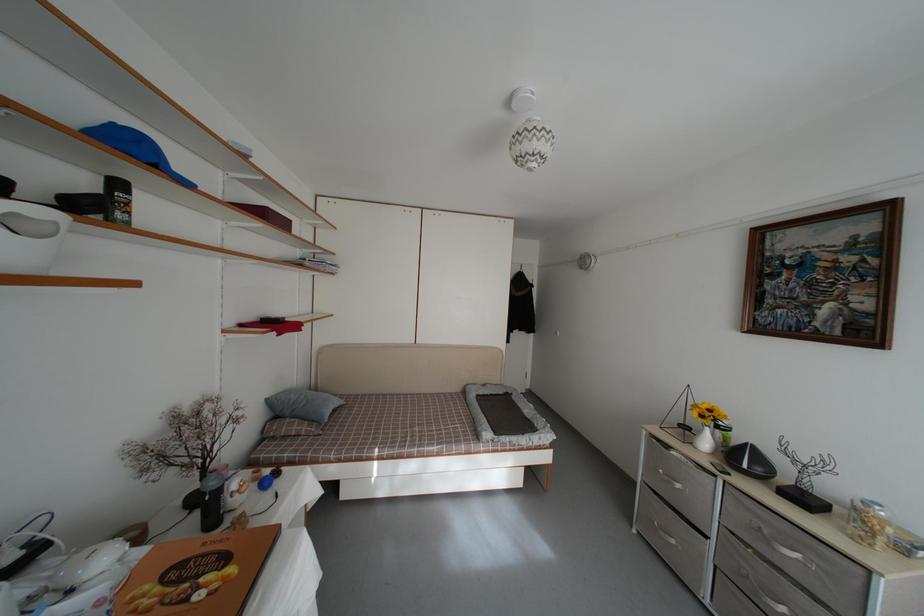
Where would you plac the brown checkered pillow? Please return your answer as a coordinate pair (x, y).

(289, 428)